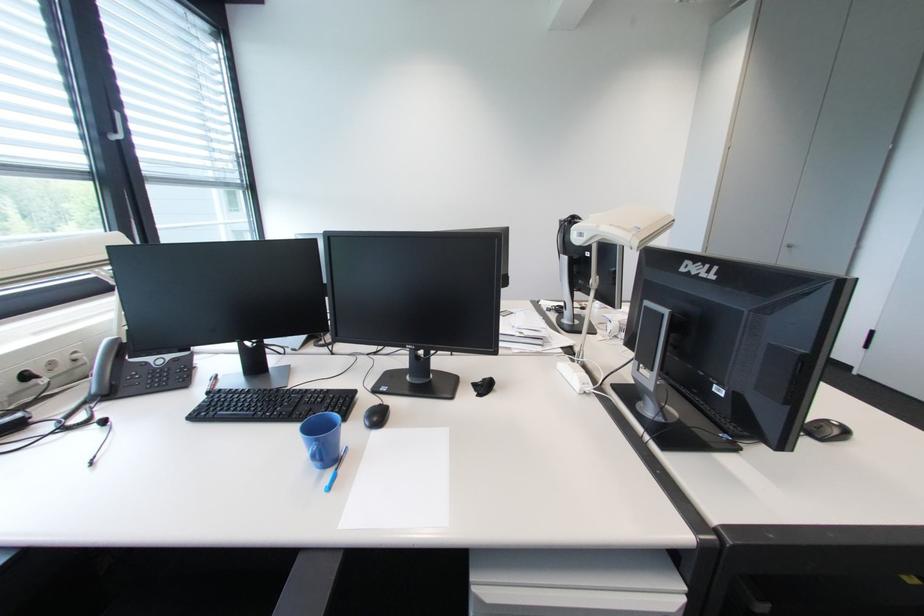
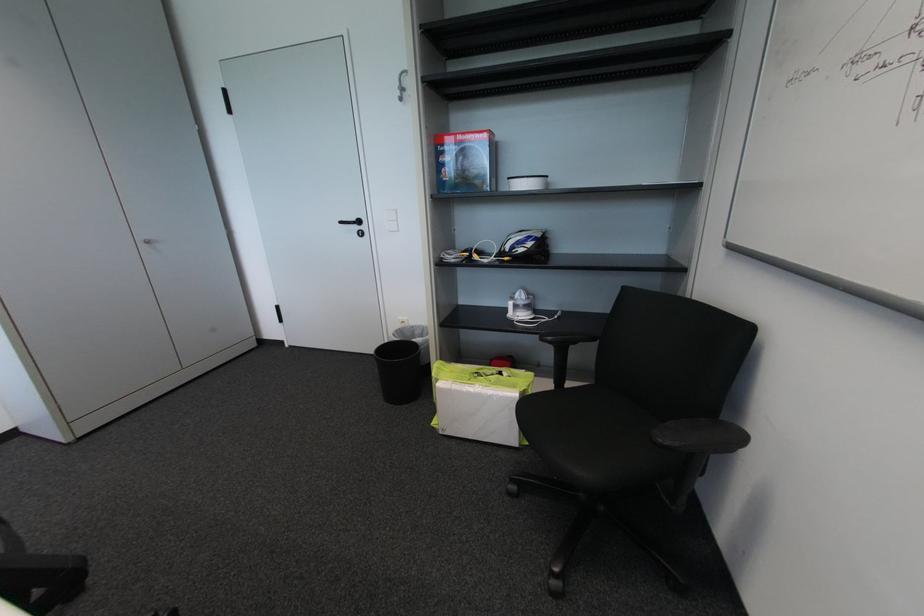
In the second image, find the point that corresponds to point 792,249 in the first image.

(151, 246)